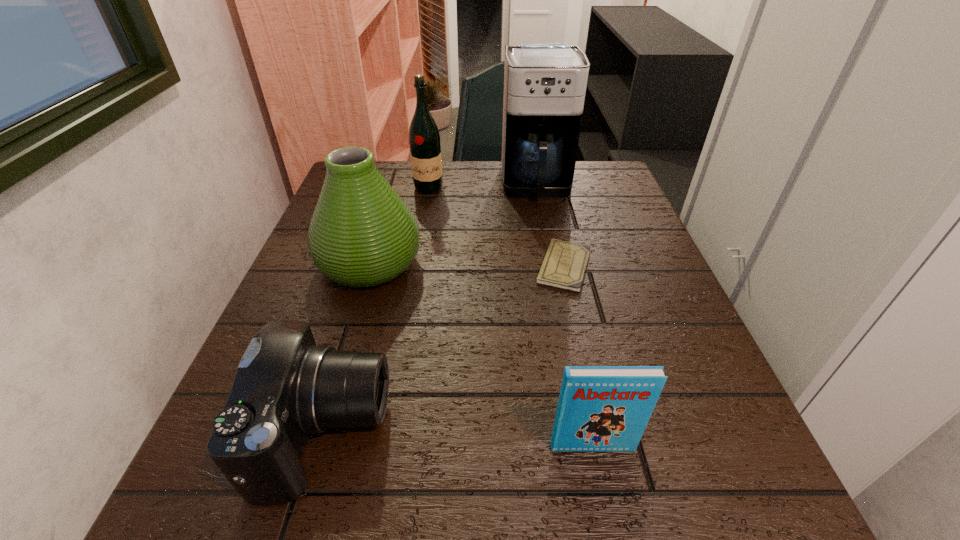
Identify the location of vacant space located 0.350m on the front of the shortest object. The image size is (960, 540). (608, 460).

This screenshot has height=540, width=960. I want to click on coffee maker present at the far edge, so click(545, 84).

Identify the location of liquor that is positioned at the far edge. (425, 149).

The height and width of the screenshot is (540, 960). I want to click on object at the near edge, so click(286, 387).

Image resolution: width=960 pixels, height=540 pixels. What are the coordinates of `vase at the left edge` in the screenshot? It's located at coord(362,234).

This screenshot has height=540, width=960. I want to click on camera that is at the left edge, so click(x=286, y=387).

Identify the location of coffee maker that is at the right edge. This screenshot has height=540, width=960. (545, 84).

The image size is (960, 540). In order to click on checkbook that is at the right edge in this screenshot , I will do `click(564, 264)`.

At what (x,y) coordinates should I click in order to perform the action: click on object situated at the near left corner. Please return your answer as a coordinate pair (x, y). The image size is (960, 540). Looking at the image, I should click on (286, 387).

Where is `object that is at the far right corner`? This screenshot has height=540, width=960. object that is at the far right corner is located at coordinates (545, 84).